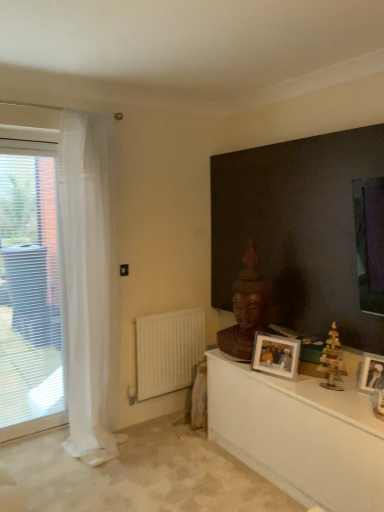
Locate an element on the screen. vacant space in front of transparent glass window at left is located at coordinates (31, 457).